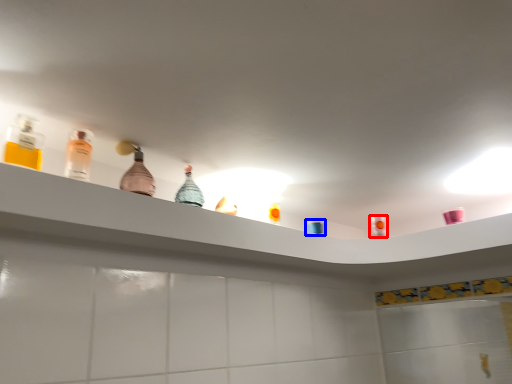
Question: Which point is further to the camera, mouthwash (highlighted by a red box) or toiletry (highlighted by a blue box)?

Choices:
 (A) mouthwash
 (B) toiletry

Answer: (A)